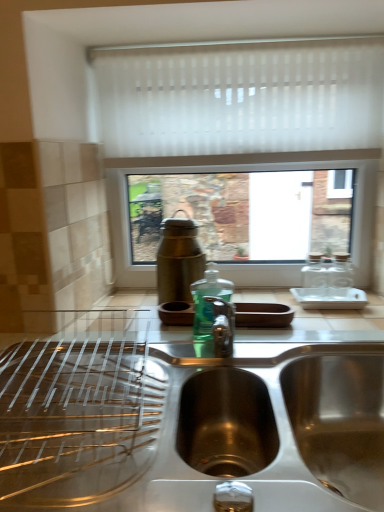
Question: Is white sheer curtain at upper center in front of or behind stainless steel sink at center in the image?

Choices:
 (A) front
 (B) behind

Answer: (B)

Question: From a real-world perspective, is white sheer curtain at upper center above or below stainless steel sink at center?

Choices:
 (A) above
 (B) below

Answer: (A)

Question: Does point (180, 54) appear closer or farther from the camera than point (173, 353)?

Choices:
 (A) farther
 (B) closer

Answer: (A)

Question: Looking at their shapes, would you say stainless steel sink at center is wider or thinner than white sheer curtain at upper center?

Choices:
 (A) thin
 (B) wide

Answer: (B)

Question: From the image's perspective, is stainless steel sink at center above or below white sheer curtain at upper center?

Choices:
 (A) above
 (B) below

Answer: (B)

Question: From a real-world perspective, is stainless steel sink at center physically located above or below white sheer curtain at upper center?

Choices:
 (A) below
 (B) above

Answer: (A)

Question: Is stainless steel sink at center situated inside white sheer curtain at upper center or outside?

Choices:
 (A) outside
 (B) inside

Answer: (A)